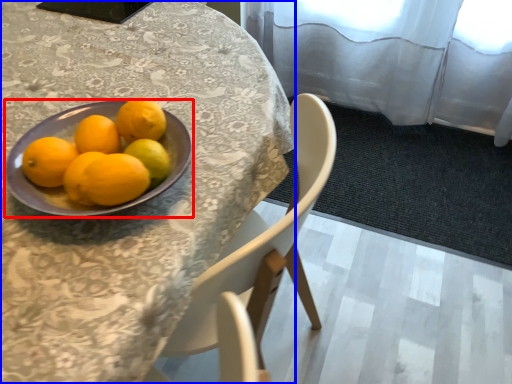
Question: Among these objects, which one is nearest to the camera, bowl (highlighted by a red box) or table (highlighted by a blue box)?

Choices:
 (A) bowl
 (B) table

Answer: (B)